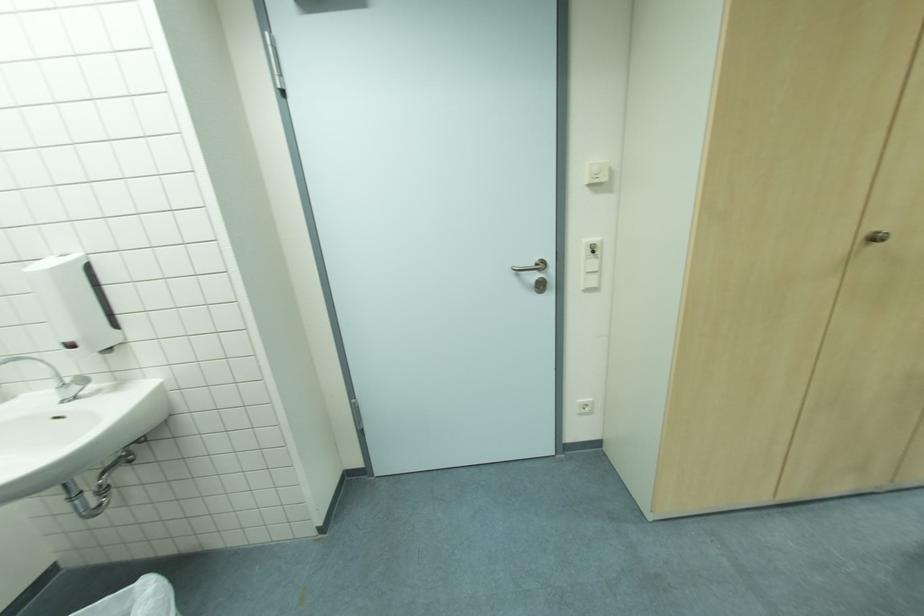
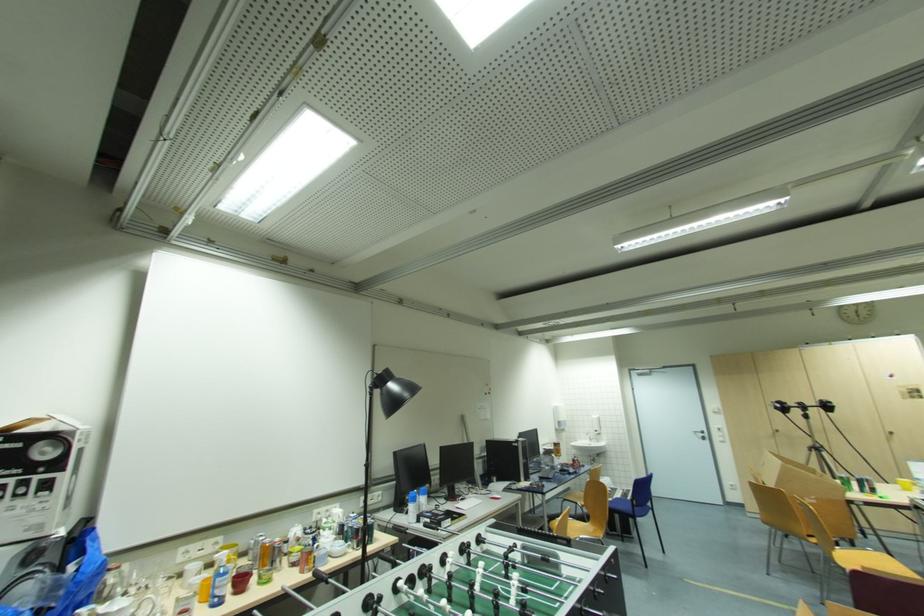
In the second image, find the point that corresponds to [540,276] in the first image.

(706, 436)